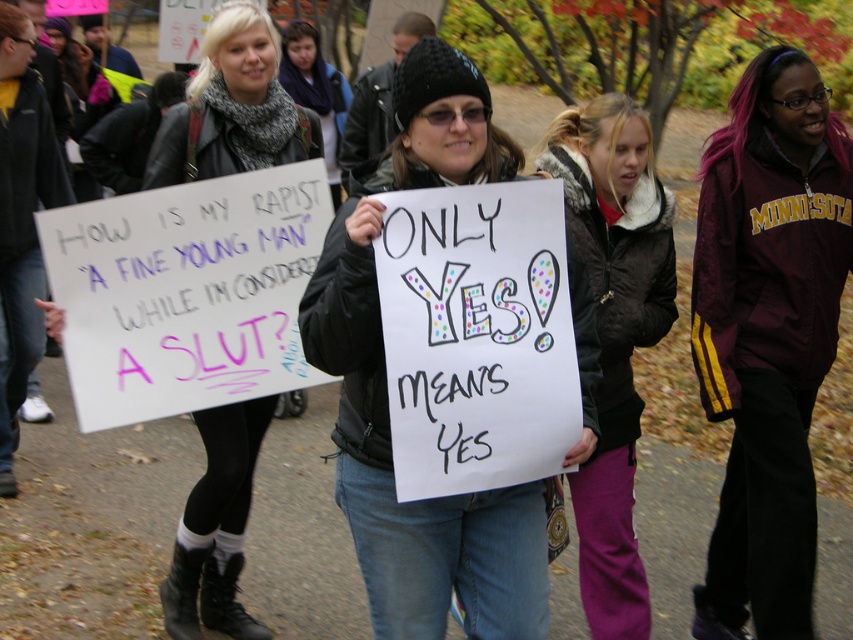
Question: From the image, what is the correct spatial relationship of maroon windbreaker at center in relation to dark brown fur-lined jacket at center?

Choices:
 (A) above
 (B) below

Answer: (A)

Question: Which point is closer to the camera?

Choices:
 (A) white paper sign at center
 (B) dark brown fur-lined jacket at center

Answer: (B)

Question: Which point is farther from the camera taking this photo?

Choices:
 (A) (221, 65)
 (B) (334, 186)

Answer: (B)

Question: Which point appears closest to the camera in this image?

Choices:
 (A) (614, 436)
 (B) (248, 102)
 (C) (335, 154)

Answer: (A)

Question: Is maroon windbreaker at center positioned before knitted scarf at center?

Choices:
 (A) no
 (B) yes

Answer: (B)

Question: Is dark brown fur-lined jacket at center closer to the viewer compared to knitted scarf at center?

Choices:
 (A) yes
 (B) no

Answer: (A)